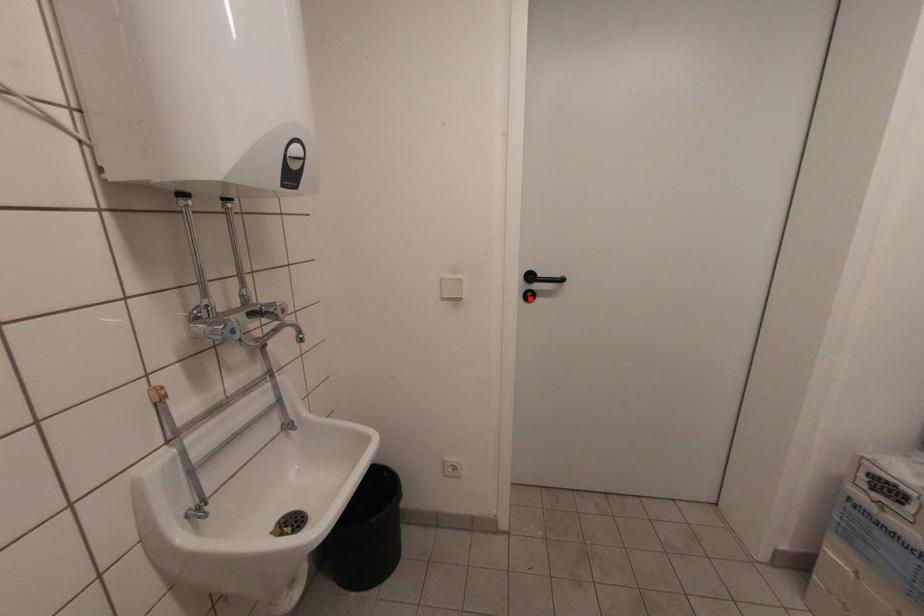
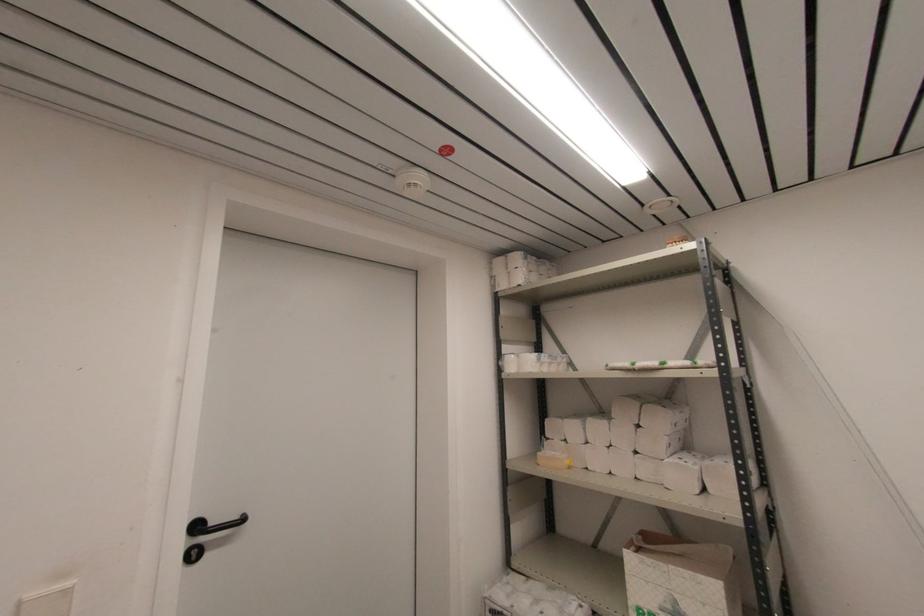
In the second image, find the point that corresponds to the highlighted location in the first image.

(196, 557)